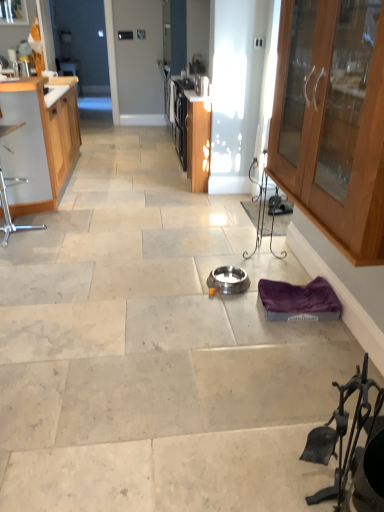
Identify the location of free space in front of satin silver bowl at center, which appears as the first appliance when viewed from the front. The image size is (384, 512). (223, 304).